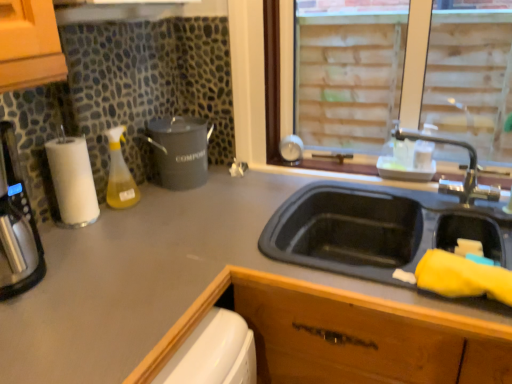
Question: In terms of width, does white paper towel at left look wider or thinner when compared to translucent yellow liquid at bottle left?

Choices:
 (A) thin
 (B) wide

Answer: (B)

Question: In terms of height, does white paper towel at left look taller or shorter compared to translucent yellow liquid at bottle left?

Choices:
 (A) tall
 (B) short

Answer: (A)

Question: Based on their relative distances, which object is farther from the white paper towel at left?

Choices:
 (A) matte black compost bin at center-left
 (B) brass metallic faucet at upper right
 (C) matte gray countertop at center
 (D) translucent yellow liquid at bottle left

Answer: (B)

Question: Estimate the real-world distances between objects in this image. Which object is closer to the matte black compost bin at center-left?

Choices:
 (A) translucent yellow liquid at bottle left
 (B) brass metallic faucet at upper right
 (C) white paper towel at left
 (D) matte gray countertop at center

Answer: (A)